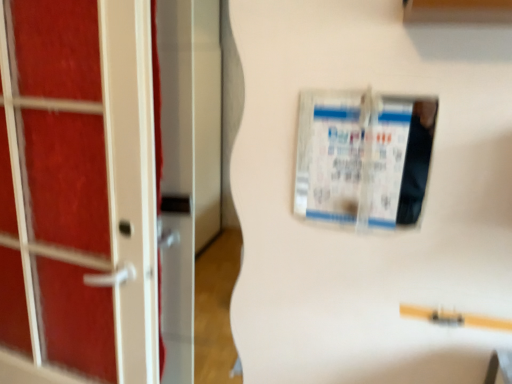
Describe the element at coordinates (79, 187) in the screenshot. Image resolution: width=512 pixels, height=384 pixels. I see `matte white door at left` at that location.

Identify the location of matte white door at left. (79, 187).

Locate an element on the screen. This screenshot has height=384, width=512. matte white door at left is located at coordinates (79, 187).